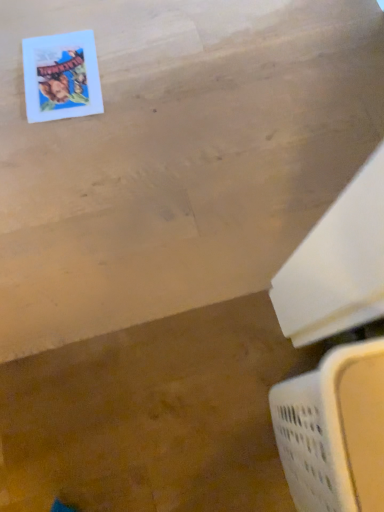
The height and width of the screenshot is (512, 384). Find the location of `free spot above matte paper comic book at upper left (from a real-world perspective)`. free spot above matte paper comic book at upper left (from a real-world perspective) is located at coordinates (61, 71).